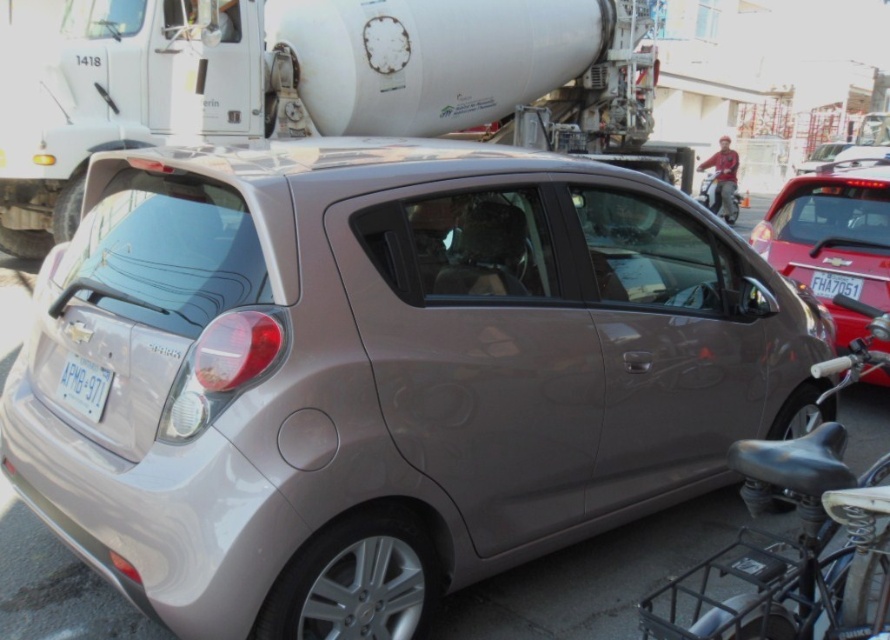
You are standing in front of the Chevrolet Spark and notice two items nearby. One is a metallic red car at right and the other is a white plastic license plate at lower left. Which one is positioned to the right side of the other?

The metallic red car at right is positioned to the right of the white plastic license plate at lower left.